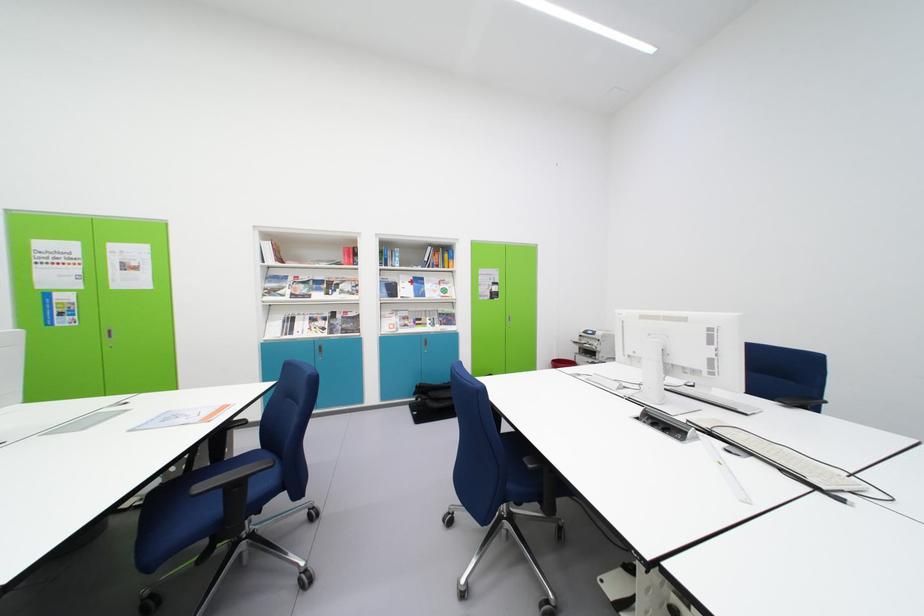
Locate an element on the screen. Image resolution: width=924 pixels, height=616 pixels. blue chair sitting surface is located at coordinates (164, 509).